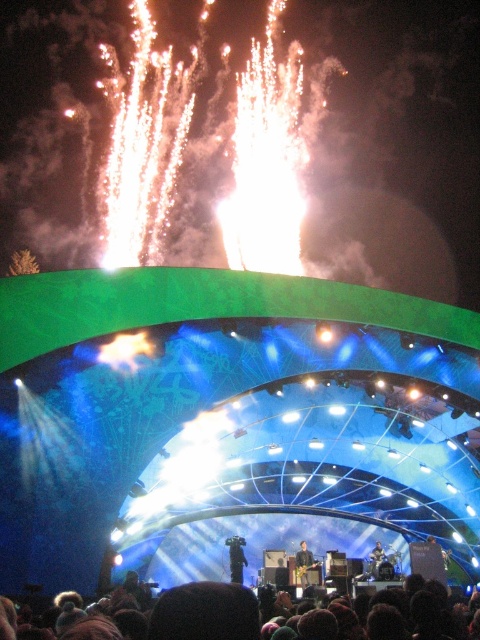
Question: Is smooth skin person at center bigger than metallic silver guitar at center?

Choices:
 (A) no
 (B) yes

Answer: (B)

Question: Can you confirm if dark blue fabric at center is positioned above metallic silver guitar at center?

Choices:
 (A) yes
 (B) no

Answer: (A)

Question: Which object is positioned closest to the brown hair at lower center?

Choices:
 (A) metallic silver guitar at center
 (B) dark blue fabric at center
 (C) smooth skin person at center

Answer: (C)

Question: Which object is farther from the camera taking this photo?

Choices:
 (A) smooth skin person at center
 (B) metallic silver guitar at center
 (C) brown hair at lower center
 (D) dark blue fabric at center

Answer: (B)

Question: Is brown hair at lower center below metallic silver guitar at center?

Choices:
 (A) yes
 (B) no

Answer: (B)

Question: Which of the following is the farthest from the observer?

Choices:
 (A) brown hair at lower center
 (B) smooth skin person at center

Answer: (B)